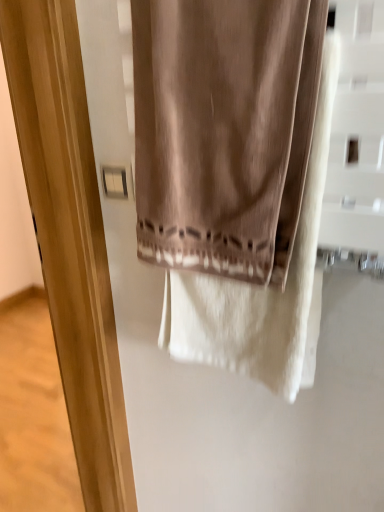
The width and height of the screenshot is (384, 512). Describe the element at coordinates (224, 131) in the screenshot. I see `satin beige curtain at center` at that location.

I want to click on satin beige curtain at center, so click(x=224, y=131).

Between satin beige curtain at center and matte wood screen door at center, which one is positioned behind?

matte wood screen door at center.

Is satin beige curtain at center turned away from matte wood screen door at center?

satin beige curtain at center is not turned away from matte wood screen door at center.

From the image's perspective, which object appears higher, satin beige curtain at center or matte wood screen door at center?

satin beige curtain at center appears higher in the image.

Considering the positions of points (276, 146) and (75, 240), is point (276, 146) closer to camera compared to point (75, 240)?

Yes, it is in front of point (75, 240).

Can you confirm if matte wood screen door at center is taller than white plastic light switch at upper left?

Yes.

Between matte wood screen door at center and white plastic light switch at upper left, which one has smaller width?

Thinner between the two is white plastic light switch at upper left.

Which is correct: matte wood screen door at center is inside white plastic light switch at upper left, or outside of it?

matte wood screen door at center exists outside the volume of white plastic light switch at upper left.

Looking at this image, can you confirm if matte wood screen door at center is smaller than white plastic light switch at upper left?

No, matte wood screen door at center is not smaller than white plastic light switch at upper left.

Is white plastic light switch at upper left in front of or behind matte wood screen door at center in the image?

white plastic light switch at upper left is positioned farther from the viewer than matte wood screen door at center.

Which is closer, (103, 170) or (78, 294)?

Point (103, 170).

Is white plastic light switch at upper left not inside matte wood screen door at center?

Yes, white plastic light switch at upper left is not within matte wood screen door at center.

From the image's perspective, is white plastic light switch at upper left on top of matte wood screen door at center?

Yes, from the image's perspective, white plastic light switch at upper left is over matte wood screen door at center.

Is white plastic light switch at upper left outside of satin beige curtain at center?

white plastic light switch at upper left lies outside satin beige curtain at center's area.

Considering the sizes of objects white plastic light switch at upper left and satin beige curtain at center in the image provided, who is wider, white plastic light switch at upper left or satin beige curtain at center?

Wider between the two is satin beige curtain at center.

Is white plastic light switch at upper left aimed at satin beige curtain at center?

No, white plastic light switch at upper left is not aimed at satin beige curtain at center.

Is point (122, 173) closer or farther from the camera than point (142, 156)?

Point (122, 173) is farther from the camera than point (142, 156).

Considering the points (70, 150) and (165, 109), which point is in front, point (70, 150) or point (165, 109)?

The point (165, 109) is closer to the camera.

How far apart are matte wood screen door at center and satin beige curtain at center?

16.96 inches.

Is the position of matte wood screen door at center less distant than that of satin beige curtain at center?

No, it is behind satin beige curtain at center.

Is matte wood screen door at center far away from satin beige curtain at center?

No, matte wood screen door at center is in close proximity to satin beige curtain at center.

In the image, is satin beige curtain at center positioned in front of or behind white plastic light switch at upper left?

In the image, satin beige curtain at center appears in front of white plastic light switch at upper left.

Between satin beige curtain at center and white plastic light switch at upper left, which one appears on the right side from the viewer's perspective?

Positioned to the right is satin beige curtain at center.

From the image's perspective, which is below, satin beige curtain at center or white plastic light switch at upper left?

white plastic light switch at upper left, from the image's perspective.

Between satin beige curtain at center and white plastic light switch at upper left, which one has larger width?

satin beige curtain at center is wider.

Find the location of a particular element. This screenshot has width=384, height=512. screen door on the left of satin beige curtain at center is located at coordinates (70, 237).

This screenshot has width=384, height=512. Identify the location of light switch above the matte wood screen door at center (from a real-world perspective). tap(114, 182).

Estimate the real-world distances between objects in this image. Which object is further from satin beige curtain at center, white plastic light switch at upper left or matte wood screen door at center?

matte wood screen door at center is positioned further to the anchor satin beige curtain at center.

When comparing their distances from white plastic light switch at upper left, does satin beige curtain at center or matte wood screen door at center seem further?

Among the two, matte wood screen door at center is located further to white plastic light switch at upper left.

Considering their positions, is matte wood screen door at center positioned further to satin beige curtain at center than white plastic light switch at upper left?

matte wood screen door at center is further to satin beige curtain at center.

Based on their spatial positions, is white plastic light switch at upper left or satin beige curtain at center further from matte wood screen door at center?

satin beige curtain at center.

Estimate the real-world distances between objects in this image. Which object is closer to white plastic light switch at upper left, matte wood screen door at center or satin beige curtain at center?

satin beige curtain at center.

When comparing their distances from matte wood screen door at center, does satin beige curtain at center or white plastic light switch at upper left seem closer?

Based on the image, white plastic light switch at upper left appears to be nearer to matte wood screen door at center.

Identify the location of screen door between satin beige curtain at center and white plastic light switch at upper left along the z-axis. (70, 237).